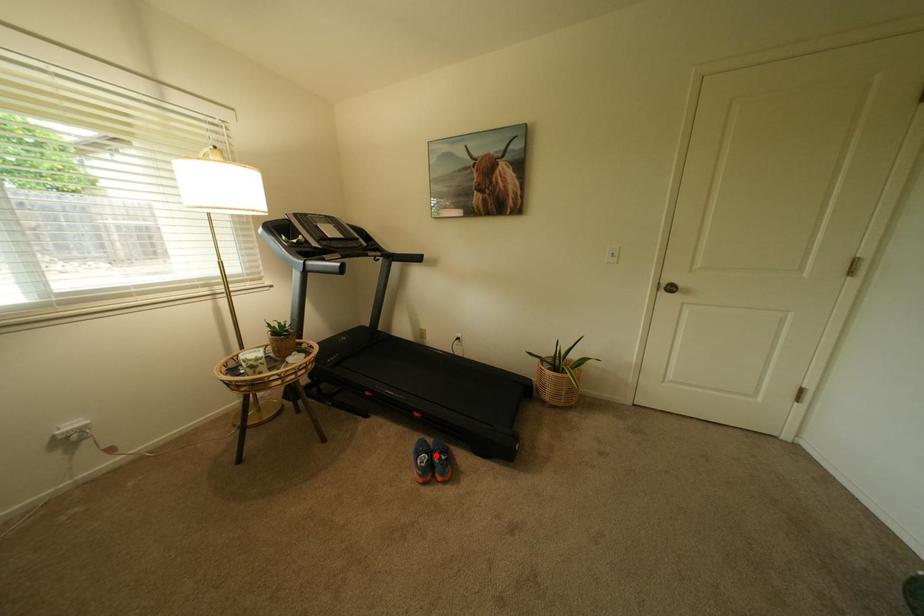
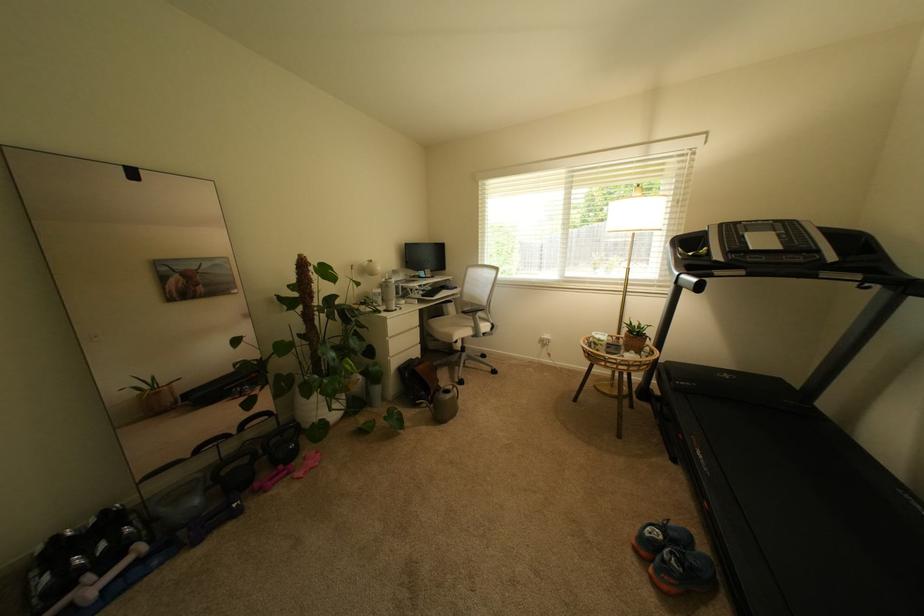
Locate, in the second image, the point that corresponds to the highlighted location in the first image.

(673, 540)